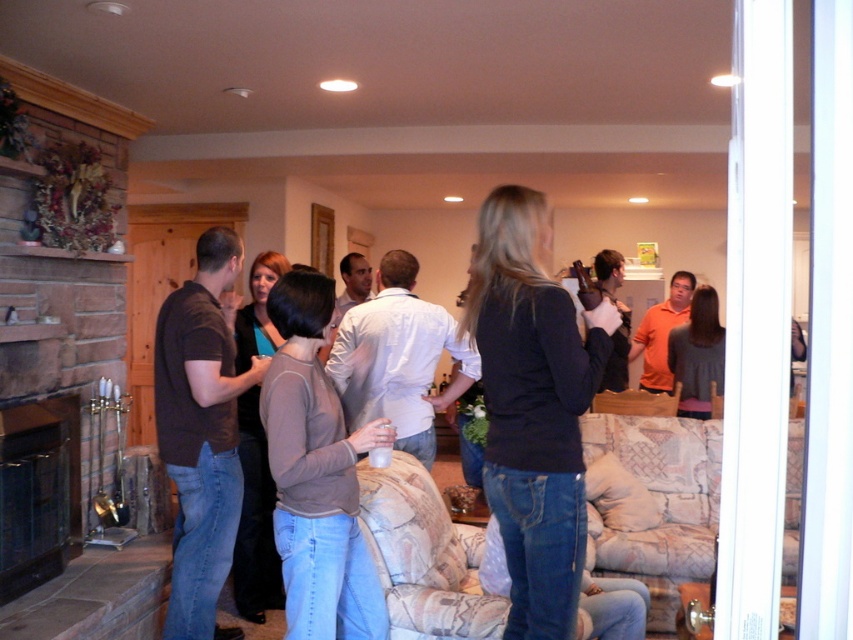
Question: Can you confirm if black stone fireplace at lower left is smaller than orange cotton shirt at center?

Choices:
 (A) yes
 (B) no

Answer: (A)

Question: Which point is farther to the camera?

Choices:
 (A) dark brown shirt at left
 (B) white cotton shirt at center

Answer: (B)

Question: Which object is positioned closest to the black matte shirt at center?

Choices:
 (A) light brown sweater at center
 (B) orange cotton shirt at center
 (C) black stone fireplace at lower left
 (D) orange cotton shirt at upper right

Answer: (A)

Question: Does light brown sweater at center have a greater width compared to orange cotton shirt at upper right?

Choices:
 (A) yes
 (B) no

Answer: (A)

Question: Is black matte shirt at center to the right of light brown sweater at center from the viewer's perspective?

Choices:
 (A) no
 (B) yes

Answer: (B)

Question: Considering the real-world distances, which object is farthest from the orange cotton shirt at center?

Choices:
 (A) black stone fireplace at lower left
 (B) white cotton shirt at center
 (C) dark brown shirt at left
 (D) black matte shirt at center

Answer: (A)